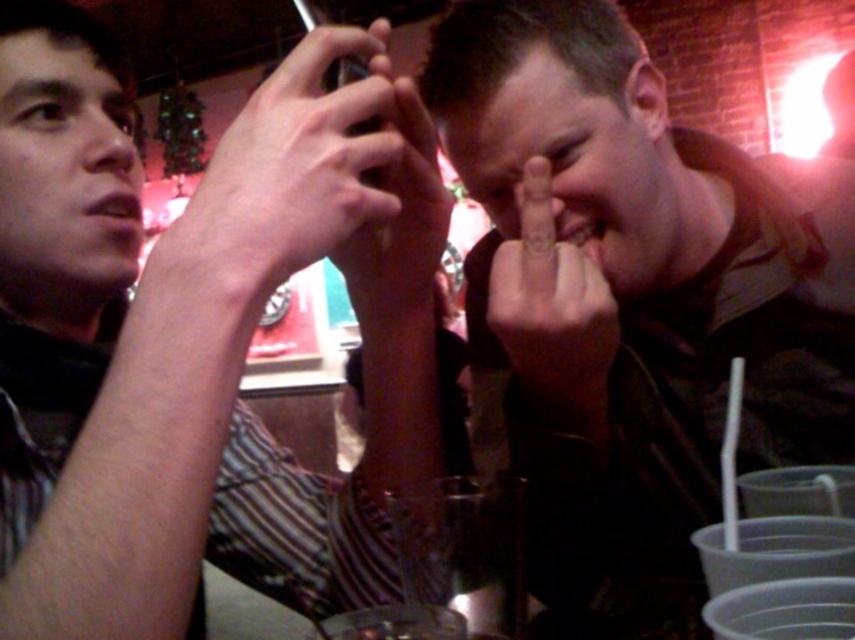
You are a bartender who needs to place a new drink order on the table. The table has a dark brown leather jacket at center and a matte skin nose at upper left. Which object should you avoid placing the drink near to prevent spilling?

You should avoid placing the drink near the matte skin nose at upper left because the dark brown leather jacket at center is taller and might block access, but the matte skin nose at upper left is shorter and closer to the edge where a spill could occur.

From the picture: You are a barista who needs to place a new coffee cup on the table between the dark brown leather jacket at center and the matte black phone at center. Based on their positions, where should you place the cup to ensure it doesn not get in the way of either item?

The dark brown leather jacket at center is located below the matte black phone at center. To avoid obstructing either item, place the coffee cup above the matte black phone at center since the jacket is already below it.